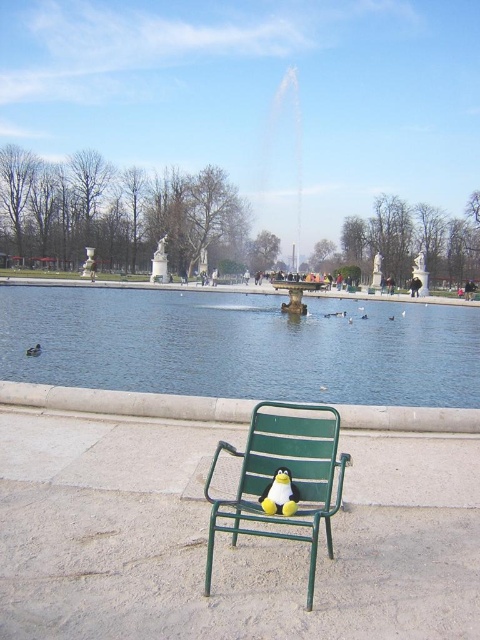
Question: Which point appears closest to the camera in this image?

Choices:
 (A) (259, 186)
 (B) (392, 317)
 (C) (287, 490)
 (D) (27, 353)

Answer: (C)

Question: Considering the relative positions of blue water at lower center and yellow plush duck at center in the image provided, where is blue water at lower center located with respect to yellow plush duck at center?

Choices:
 (A) above
 (B) below

Answer: (A)

Question: Which point is closer to the camera?

Choices:
 (A) green metal chair at center
 (B) blue water at lower center
 (C) white matte duck at center
 (D) metallic fountain at center

Answer: (A)

Question: Can you confirm if green metal chair at center is positioned to the left of white matte duck at center?

Choices:
 (A) no
 (B) yes

Answer: (B)

Question: Can you confirm if blue water at lower center is positioned above yellow plush duck at center?

Choices:
 (A) yes
 (B) no

Answer: (A)

Question: Which of the following is the farthest from the observer?

Choices:
 (A) (300, 323)
 (B) (282, 460)
 (C) (365, 316)
 (D) (28, 348)

Answer: (C)